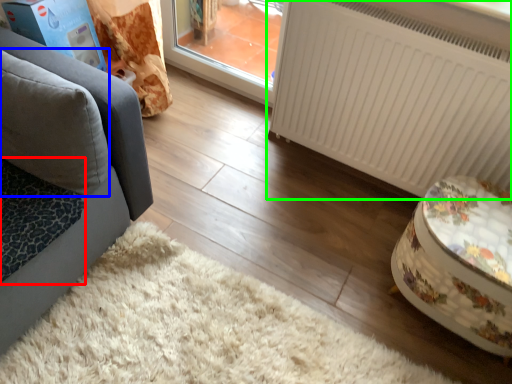
Question: Estimate the real-world distances between objects in this image. Which object is closer to cat bed (highlighted by a red box), pillow (highlighted by a blue box) or radiator (highlighted by a green box)?

Choices:
 (A) pillow
 (B) radiator

Answer: (A)